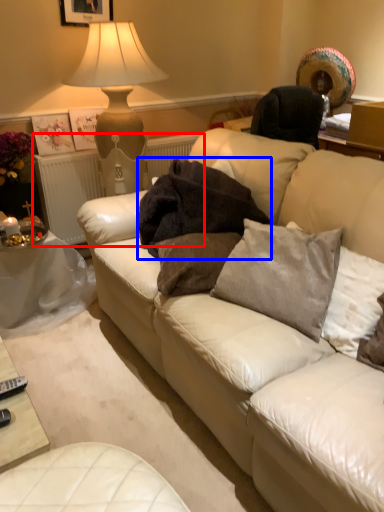
Question: Which of the following is the farthest to the observer, radiator (highlighted by a red box) or blanket (highlighted by a blue box)?

Choices:
 (A) radiator
 (B) blanket

Answer: (A)